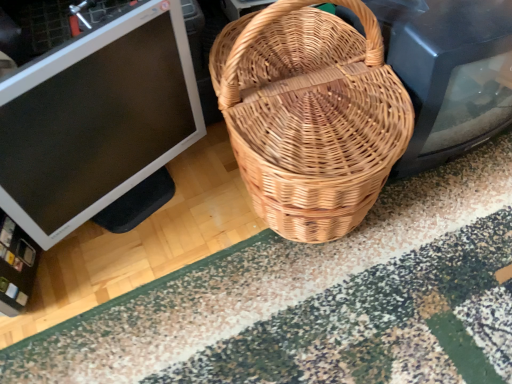
Question: Is matte black monitor at left oriented away from patterned carpet at center?

Choices:
 (A) no
 (B) yes

Answer: (A)

Question: Does matte black monitor at left come behind patterned carpet at center?

Choices:
 (A) no
 (B) yes

Answer: (A)

Question: From the image's perspective, is matte black monitor at left under patterned carpet at center?

Choices:
 (A) no
 (B) yes

Answer: (A)

Question: Is matte black monitor at left far from patterned carpet at center?

Choices:
 (A) no
 (B) yes

Answer: (A)

Question: From a real-world perspective, is matte black monitor at left located higher than patterned carpet at center?

Choices:
 (A) yes
 (B) no

Answer: (A)

Question: Is matte black monitor at left at the left side of patterned carpet at center?

Choices:
 (A) no
 (B) yes

Answer: (B)

Question: Does patterned carpet at center have a lesser height compared to matte black monitor at left?

Choices:
 (A) yes
 (B) no

Answer: (A)

Question: Is patterned carpet at center turned away from matte black monitor at left?

Choices:
 (A) no
 (B) yes

Answer: (A)

Question: Are patterned carpet at center and matte black monitor at left beside each other?

Choices:
 (A) yes
 (B) no

Answer: (B)

Question: Can you confirm if patterned carpet at center is taller than matte black monitor at left?

Choices:
 (A) yes
 (B) no

Answer: (B)

Question: From the image's perspective, is patterned carpet at center above matte black monitor at left?

Choices:
 (A) yes
 (B) no

Answer: (B)

Question: From the image's perspective, is patterned carpet at center located beneath matte black monitor at left?

Choices:
 (A) yes
 (B) no

Answer: (A)

Question: Considering the relative positions of natural woven picnic basket at center and matte black monitor at left in the image provided, is natural woven picnic basket at center to the left of matte black monitor at left from the viewer's perspective?

Choices:
 (A) no
 (B) yes

Answer: (A)